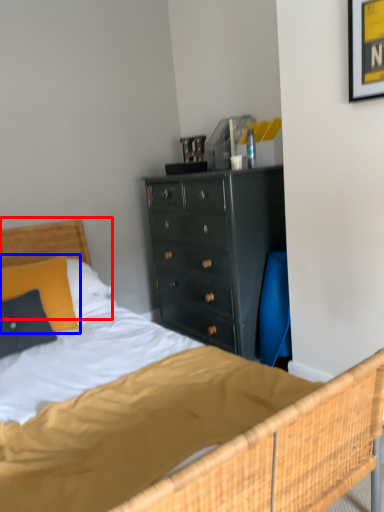
Question: Which object appears farthest to the camera in this image, headboard (highlighted by a red box) or pillow (highlighted by a blue box)?

Choices:
 (A) headboard
 (B) pillow

Answer: (A)